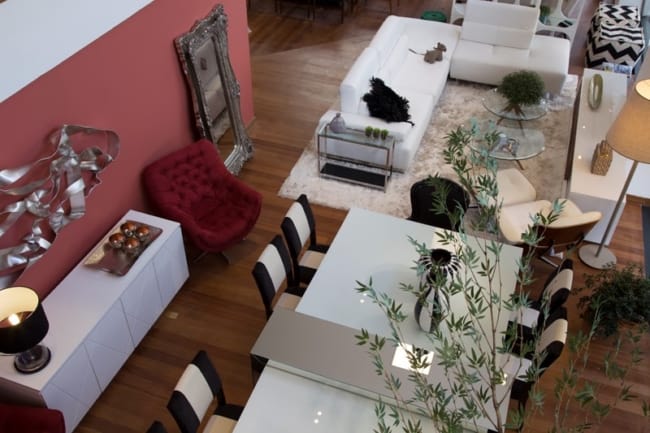
Locate an element on the screen. This screenshot has height=433, width=650. red wall is located at coordinates (117, 102).